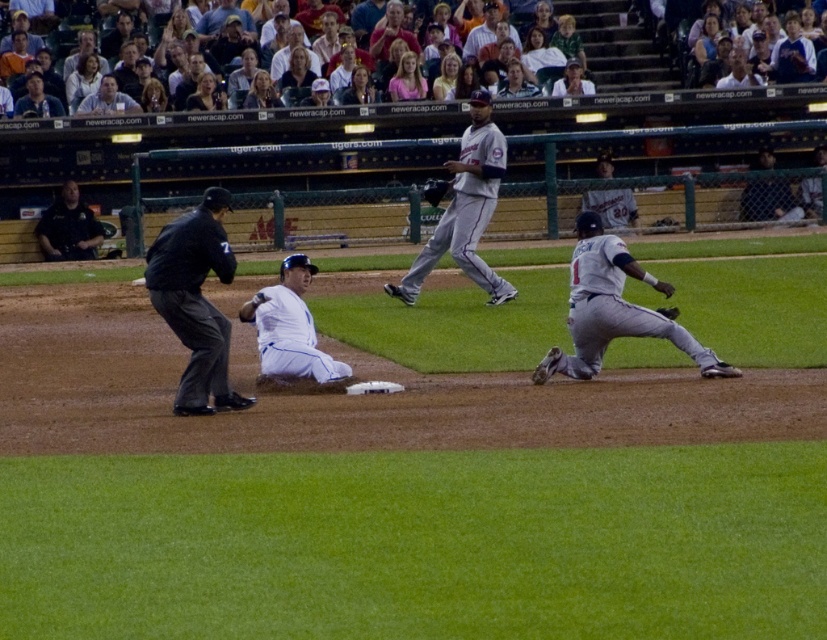
Question: Considering the relative positions of dark gray uniform at upper right and white jersey at upper right in the image provided, where is dark gray uniform at upper right located with respect to white jersey at upper right?

Choices:
 (A) right
 (B) left

Answer: (A)

Question: Does dark blue uniform at upper center appear over dark gray leather glove at lower right?

Choices:
 (A) yes
 (B) no

Answer: (A)

Question: Which is nearer to the dark blue shirt at upper left?

Choices:
 (A) black fabric umpire at left
 (B) dark gray leather glove at lower right
 (C) gray matte uniform at lower right

Answer: (A)

Question: Which object is the closest to the dark blue shirt at upper left?

Choices:
 (A) dark gray uniform at upper right
 (B) white jersey at center

Answer: (B)

Question: In this image, where is gray uniformed player at center located relative to dark blue uniform at upper center?

Choices:
 (A) left
 (B) right

Answer: (B)

Question: Which object is closer to the camera taking this photo?

Choices:
 (A) dark gray leather glove at center
 (B) dark blue shirt at upper left

Answer: (A)